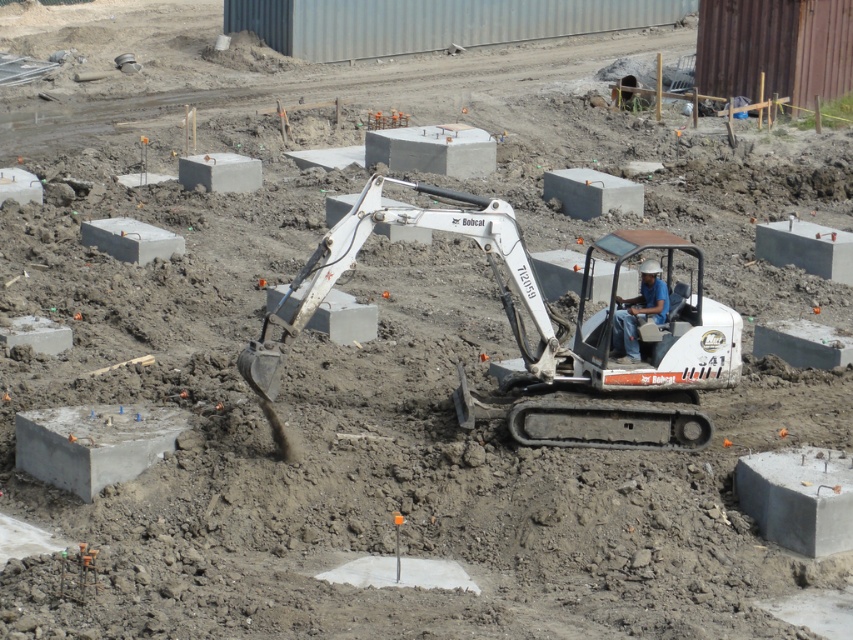
Can you confirm if white metallic excavator at center is positioned above gray concrete block at lower left?

Yes, white metallic excavator at center is above gray concrete block at lower left.

How much distance is there between white metallic excavator at center and gray concrete block at lower left?

They are 4.73 meters apart.

Does point (473, 412) come closer to viewer compared to point (157, 458)?

No, (473, 412) is behind (157, 458).

Locate an element on the screen. The width and height of the screenshot is (853, 640). white metallic excavator at center is located at coordinates (543, 333).

Between point (167, 413) and point (787, 532), which one is positioned in front?

Point (787, 532) is more forward.

Who is shorter, gray concrete block at lower left or gray concrete block at lower right?

gray concrete block at lower left

Is point (102, 449) more distant than point (786, 508)?

Yes, it is.

You are a GUI agent. You are given a task and a screenshot of the screen. Output one action in this format:
    pyautogui.click(x=<x>, y=<y>)
    Task: Click on the gray concrete block at lower left
    
    Given the screenshot: What is the action you would take?
    pyautogui.click(x=93, y=444)

Where is `gray concrete block at lower left`? The width and height of the screenshot is (853, 640). gray concrete block at lower left is located at coordinates (93, 444).

Does point (97, 480) come behind point (657, 273)?

No, (97, 480) is in front of (657, 273).

This screenshot has height=640, width=853. I want to click on gray concrete block at lower left, so click(93, 444).